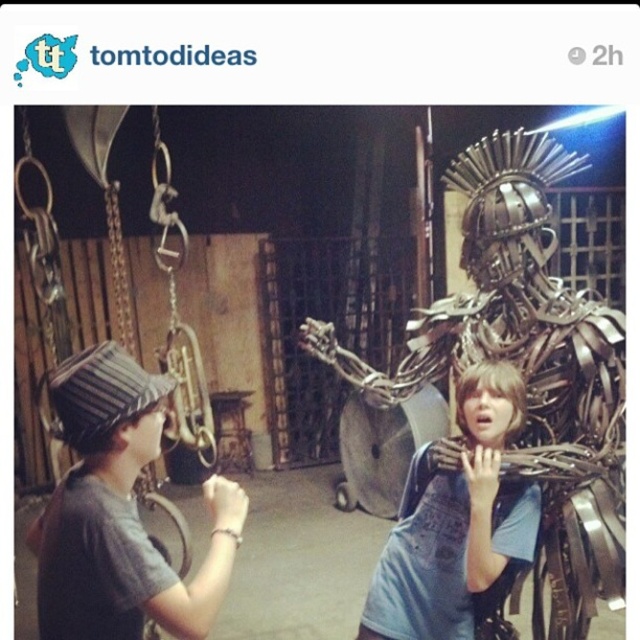
Which is behind, point (109, 369) or point (380, 612)?

Positioned behind is point (380, 612).

Which is below, striped fabric hat at left or metallic wire sculpture at center?

metallic wire sculpture at center is lower down.

The image size is (640, 640). I want to click on striped fabric hat at left, so click(120, 513).

Does metallic armor at right appear under metallic wire sculpture at center?

No, metallic armor at right is not below metallic wire sculpture at center.

At what (x,y) coordinates should I click in order to perform the action: click on metallic armor at right. Please return your answer as a coordinate pair (x, y). Looking at the image, I should click on click(x=528, y=365).

Measure the distance between metallic armor at right and camera.

metallic armor at right is 5.94 feet from camera.

This screenshot has height=640, width=640. What are the coordinates of `metallic armor at right` in the screenshot? It's located at (528, 365).

Is metallic armor at right smaller than striped fabric hat at left?

Actually, metallic armor at right might be larger than striped fabric hat at left.

Who is positioned more to the left, metallic armor at right or striped fabric hat at left?

striped fabric hat at left is more to the left.

Between point (516, 160) and point (125, 492), which one is positioned behind?

Point (516, 160)

Identify the location of metallic armor at right. The width and height of the screenshot is (640, 640). (528, 365).